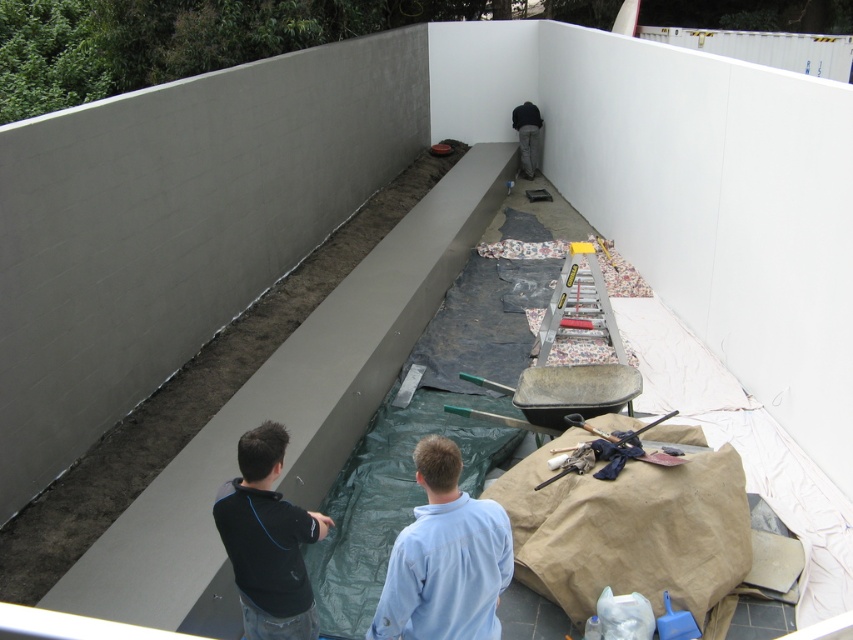
You are standing at the construction site and want to place a safety cone exactly 3 meters away from your current position. Given the point at coordinates point (415,632), which is 2.59 meters away from you, can you determine if placing the cone at this point would be sufficient to meet the 3 meter safety requirement?

The point at coordinates point (415,632) is only 2.59 meters away from your current position, which is less than the required 3 meters. Therefore, placing the cone there would not meet the safety requirement. You need to move further away to ensure the cone is at least 3 meters from your position.

You are a safety inspector observing the construction site. You notice two workers wearing a light blue shirt at center and a black matte shirt at lower left. Based on their positions, which worker is closer to the trench located at the center of the site?

The light blue shirt at center is in front of the black matte shirt at lower left, so the light blue shirt at center is closer to the trench located at the center of the site.

You are a safety inspector at the construction site. You notice two workers wearing a light blue shirt at center and dark gray pants at center. According to safety regulations, all workers must wear clothing with a minimum width of 50 cm for visibility. Can both workers comply with this requirement based on their current attire?

The light blue shirt at center has a width larger than the dark gray pants at center. Since the shirt is wider than the pants, but we don not have exact measurements, we cannot confirm if the shirt meets the 50 cm requirement. However, if the pants are narrower than the shirt and the shirt is over 50 cm, then the shirt complies, but the pants might not. Without specific measurements, it is uncertain if both meet the requirement.